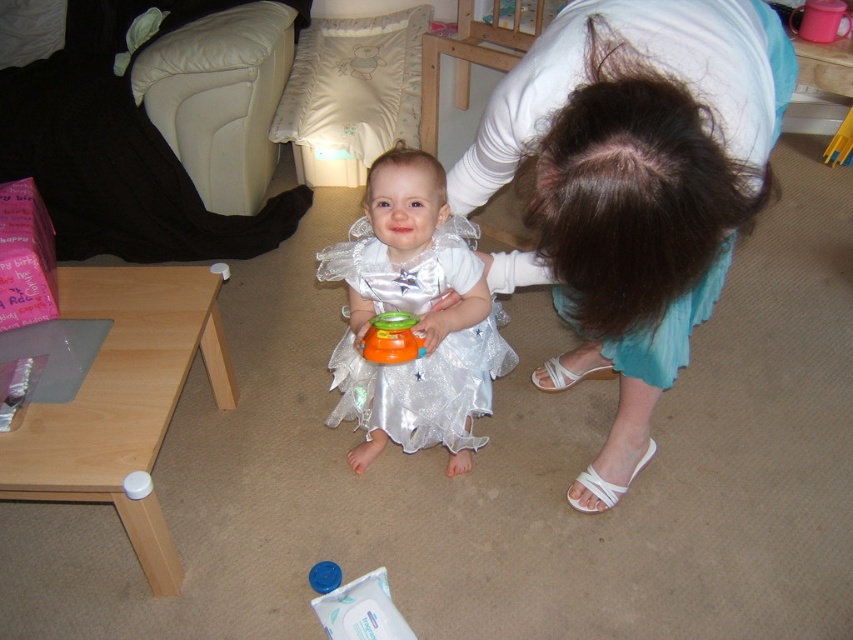
Who is higher up, satin white dress at center or orange rubber toy at center?

orange rubber toy at center is above.

Is satin white dress at center wider than orange rubber toy at center?

Correct, the width of satin white dress at center exceeds that of orange rubber toy at center.

Locate an element on the screen. This screenshot has width=853, height=640. satin white dress at center is located at coordinates (422, 387).

Is the position of white satin dress at upper center more distant than that of satin white dress at center?

No.

Based on the photo, is white satin dress at upper center smaller than satin white dress at center?

Actually, white satin dress at upper center might be larger than satin white dress at center.

In order to click on white satin dress at upper center in this screenshot , I will do `click(631, 188)`.

Locate an element on the screen. Image resolution: width=853 pixels, height=640 pixels. white satin dress at upper center is located at coordinates (631, 188).

In the scene shown: Does black leather couch at upper left come in front of satin white dress at center?

No, it is behind satin white dress at center.

Does black leather couch at upper left appear under satin white dress at center?

No.

Between point (172, 10) and point (345, 268), which one is positioned in front?

Point (345, 268)

You are a GUI agent. You are given a task and a screenshot of the screen. Output one action in this format:
    pyautogui.click(x=<x>, y=<y>)
    Task: Click on the black leather couch at upper left
    The height and width of the screenshot is (640, 853).
    Given the screenshot: What is the action you would take?
    pyautogui.click(x=119, y=152)